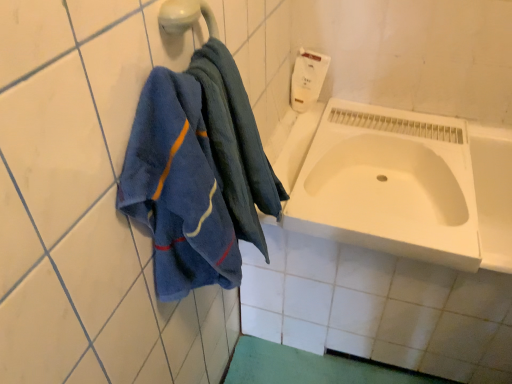
Question: In terms of size, does white matte soap dispenser at upper right appear bigger or smaller than white matte sink at lower right?

Choices:
 (A) small
 (B) big

Answer: (A)

Question: From their relative heights in the image, would you say white matte soap dispenser at upper right is taller or shorter than white matte sink at lower right?

Choices:
 (A) short
 (B) tall

Answer: (B)

Question: Which is farther from the white matte sink at lower right?

Choices:
 (A) blue cotton towel at left
 (B) white matte soap dispenser at upper right
 (C) white glossy bathtub at center

Answer: (A)

Question: Estimate the real-world distances between objects in this image. Which object is farther from the white matte sink at lower right?

Choices:
 (A) blue cotton towel at left
 (B) white glossy bathtub at center
 (C) white matte soap dispenser at upper right

Answer: (A)